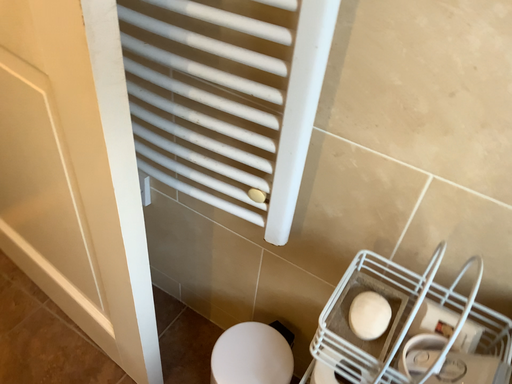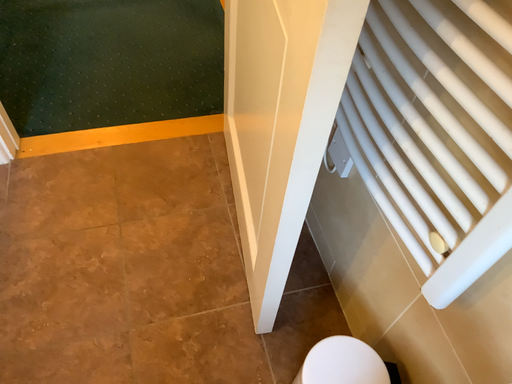
Question: Which way did the camera rotate in the video?

Choices:
 (A) rotated left
 (B) rotated right

Answer: (A)